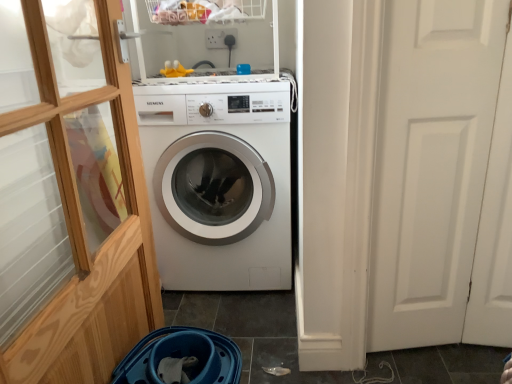
Question: Considering the relative positions of white matte door at right and white plastic shelf at upper center in the image provided, is white matte door at right to the left of white plastic shelf at upper center from the viewer's perspective?

Choices:
 (A) no
 (B) yes

Answer: (A)

Question: Is white matte door at right shorter than white plastic shelf at upper center?

Choices:
 (A) yes
 (B) no

Answer: (B)

Question: Does white matte door at right have a larger size compared to white plastic shelf at upper center?

Choices:
 (A) no
 (B) yes

Answer: (A)

Question: From a real-world perspective, is white matte door at right positioned over white plastic shelf at upper center based on gravity?

Choices:
 (A) yes
 (B) no

Answer: (B)

Question: Is white matte door at right at the right side of white plastic shelf at upper center?

Choices:
 (A) yes
 (B) no

Answer: (A)

Question: Can you confirm if white matte door at right is taller than white plastic shelf at upper center?

Choices:
 (A) no
 (B) yes

Answer: (B)

Question: Is white plastic shelf at upper center touching white matte door at right?

Choices:
 (A) no
 (B) yes

Answer: (A)

Question: Is white plastic shelf at upper center positioned with its back to white matte door at right?

Choices:
 (A) no
 (B) yes

Answer: (A)

Question: Can you confirm if white plastic shelf at upper center is taller than white matte door at right?

Choices:
 (A) yes
 (B) no

Answer: (B)

Question: Is white matte door at right completely or partially inside white plastic shelf at upper center?

Choices:
 (A) yes
 (B) no

Answer: (B)

Question: Is white plastic shelf at upper center far from white matte door at right?

Choices:
 (A) yes
 (B) no

Answer: (B)

Question: Does white plastic shelf at upper center have a smaller size compared to white matte door at right?

Choices:
 (A) no
 (B) yes

Answer: (A)

Question: Is white plastic shelf at upper center at the right side of white glossy washing machine at center?

Choices:
 (A) no
 (B) yes

Answer: (A)